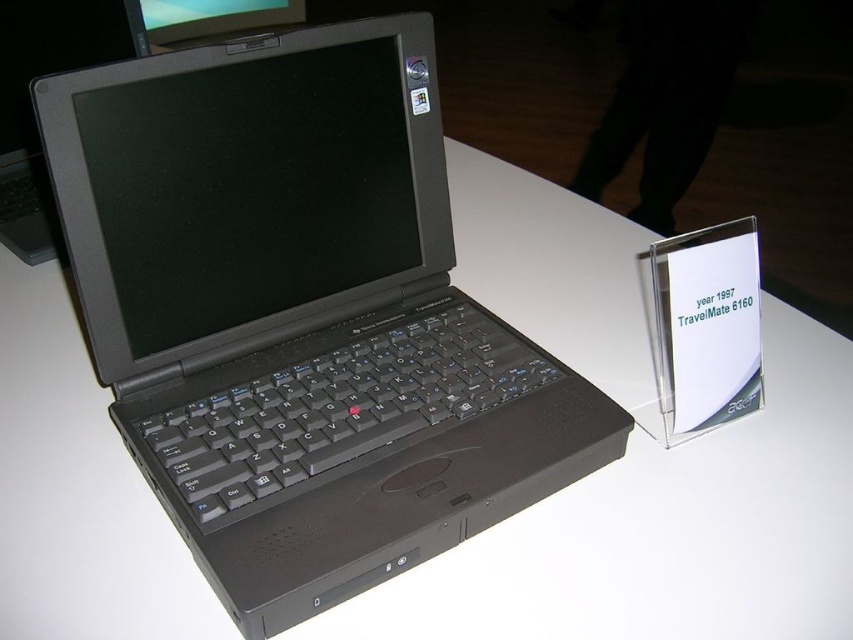
You are at an exhibition and see two laptops displayed. One is labeled as a matte black laptop at center and the other as a black matte laptop at center. Which one is taller?

The matte black laptop at center is taller than the black matte laptop at center.

You are at an exhibition and want to take a photo of the matte black laptop at center and the black matte laptop at center. Which one is positioned closer to the front of the display?

The matte black laptop at center is closer to the viewer than the black matte laptop at center, so it is positioned closer to the front of the display.

You are at an exhibition and see two laptops labeled as matte black laptop at center and black matte laptop at center. Which one is wider?

The matte black laptop at center is wider than the black matte laptop at center according to the description.